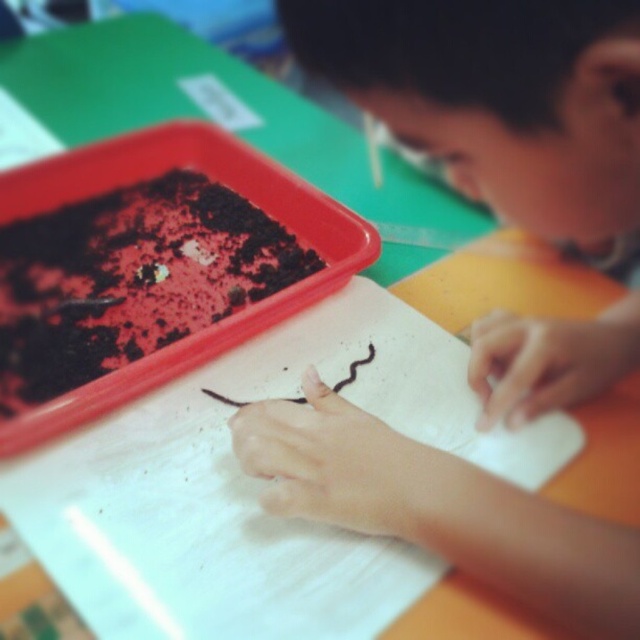
You are a parent trying to decide whether to place a chocolate cake at center on the table where your child, the smooth skin boy at center, is currently working with a worm. Considering the distance between them, is there enough space to avoid the cake getting dirty from the soil activity?

The smooth skin boy at center and chocolate cake at center are 11.26 inches apart from each other. This distance should provide sufficient space to prevent the cake from being soiled by the soil activity, as the child is focused on their task and the cake is not in the immediate work area.

Looking at the scene, where is the smooth skin boy at center in relation to the chocolate cake at center?

The smooth skin boy at center is to the right of the chocolate cake at center.